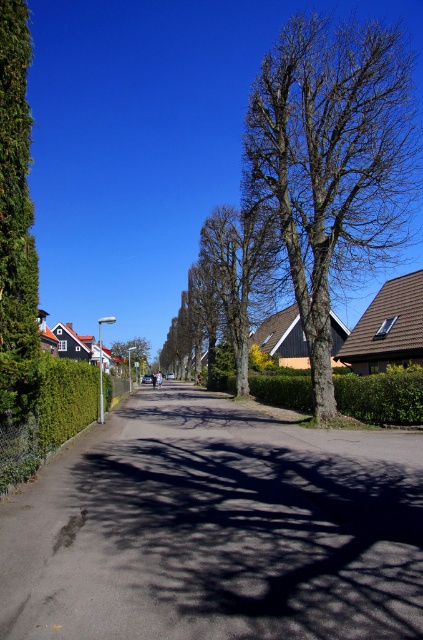
Does green hedge at center lie in front of white plastic street sign at center?

Yes, it is in front of white plastic street sign at center.

Between green hedge at center and white plastic street sign at center, which one has less height?

With less height is green hedge at center.

Describe the element at coordinates (216, 529) in the screenshot. I see `green hedge at center` at that location.

Locate an element on the screen. green hedge at center is located at coordinates (216, 529).

Between green textured hedge at left and green hedge at left, which one is positioned lower?

green hedge at left is lower down.

Does green textured hedge at left have a greater width compared to green hedge at left?

No.

Describe the element at coordinates (16, 221) in the screenshot. I see `green textured hedge at left` at that location.

Image resolution: width=423 pixels, height=640 pixels. I want to click on green textured hedge at left, so click(16, 221).

Based on the photo, which of these two, green hedge at left or white plastic street sign at center, stands taller?

white plastic street sign at center is taller.

The image size is (423, 640). What do you see at coordinates (49, 417) in the screenshot? I see `green hedge at left` at bounding box center [49, 417].

Locate an element on the screen. This screenshot has width=423, height=640. green hedge at left is located at coordinates (49, 417).